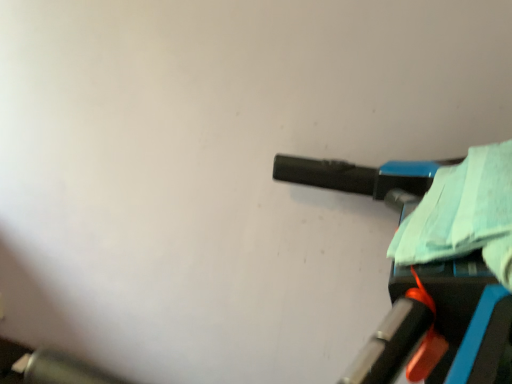
Where is `matte black vacuum cleaner at right`? This screenshot has width=512, height=384. matte black vacuum cleaner at right is located at coordinates (445, 325).

Describe the element at coordinates (445, 325) in the screenshot. I see `matte black vacuum cleaner at right` at that location.

In order to face matte black vacuum cleaner at right, should I rotate leftwards or rightwards?

Turn right approximately 26.807 degrees to face it.

The height and width of the screenshot is (384, 512). I want to click on matte black vacuum cleaner at right, so click(445, 325).